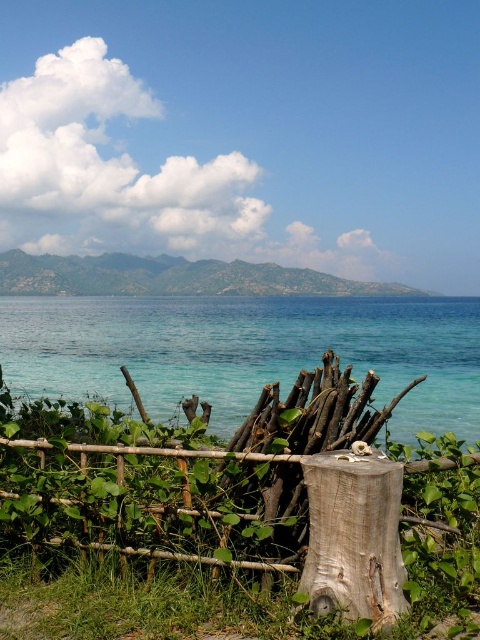
Which is in front, point (190, 456) or point (160, 352)?

Point (190, 456)

Between green leafy vegetation at center and clear blue water at lower center, which one is positioned lower?

green leafy vegetation at center

Is point (242, 564) farther from camera compared to point (248, 310)?

No, it is not.

The image size is (480, 640). Identify the location of green leafy vegetation at center. (147, 502).

Does clear blue water at lower center have a greater width compared to light brown wood stump at center?

Indeed, clear blue water at lower center has a greater width compared to light brown wood stump at center.

Between clear blue water at lower center and light brown wood stump at center, which one appears on the left side from the viewer's perspective?

light brown wood stump at center is more to the left.

Is point (167, 330) positioned before point (384, 608)?

That is False.

This screenshot has height=640, width=480. Identify the location of clear blue water at lower center. (247, 352).

Which is behind, point (256, 552) or point (324, 604)?

The point (256, 552) is behind.

Looking at this image, can you confirm if green leafy vegetation at center is positioned to the right of light brown wood stump at center?

In fact, green leafy vegetation at center is to the left of light brown wood stump at center.

Identify the location of green leafy vegetation at center. The height and width of the screenshot is (640, 480). (147, 502).